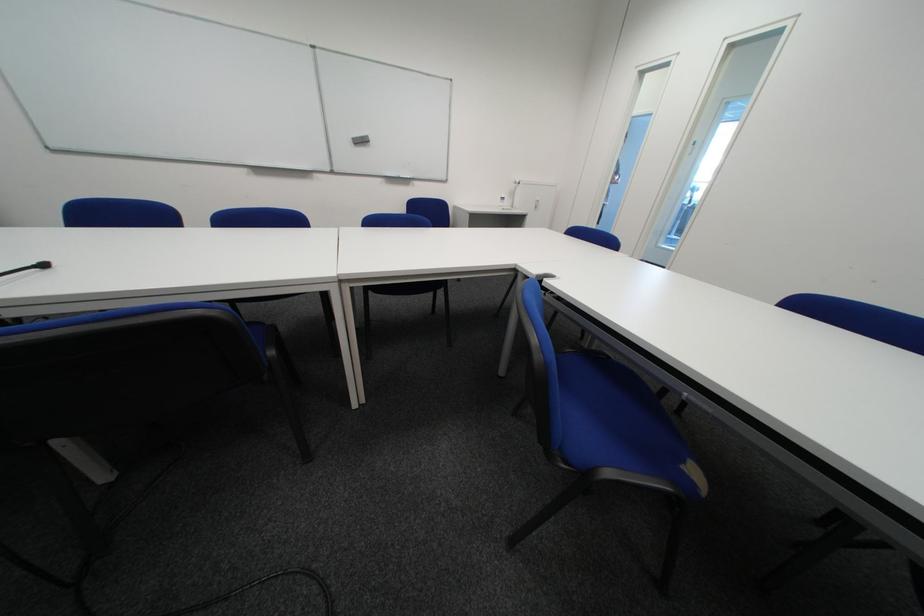
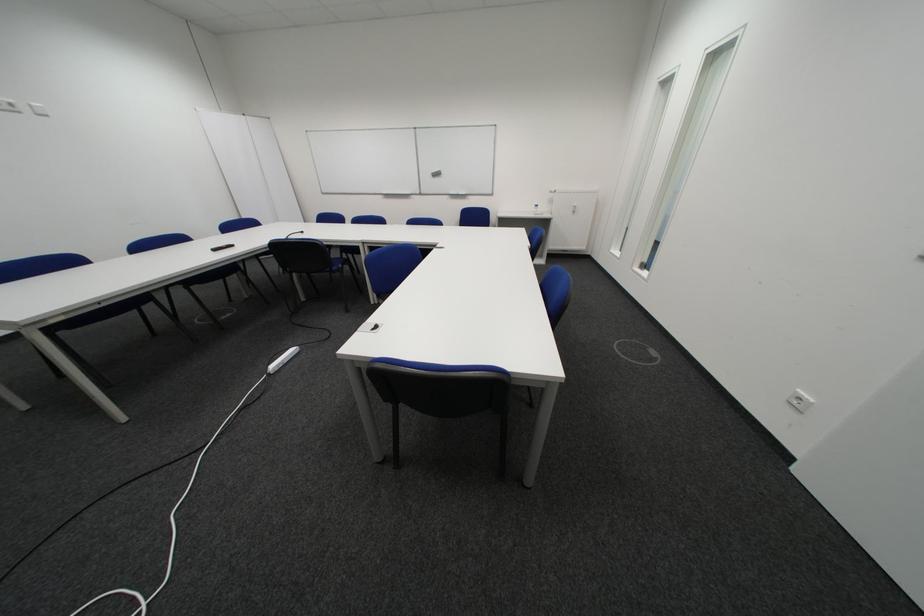
The point at (516,209) is marked in the first image. Where is the corresponding point in the second image?

(548, 215)